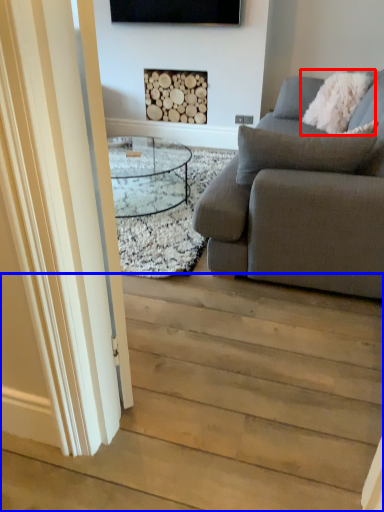
Question: Among these objects, which one is nearest to the camera, pillow (highlighted by a red box) or stairwell (highlighted by a blue box)?

Choices:
 (A) pillow
 (B) stairwell

Answer: (B)